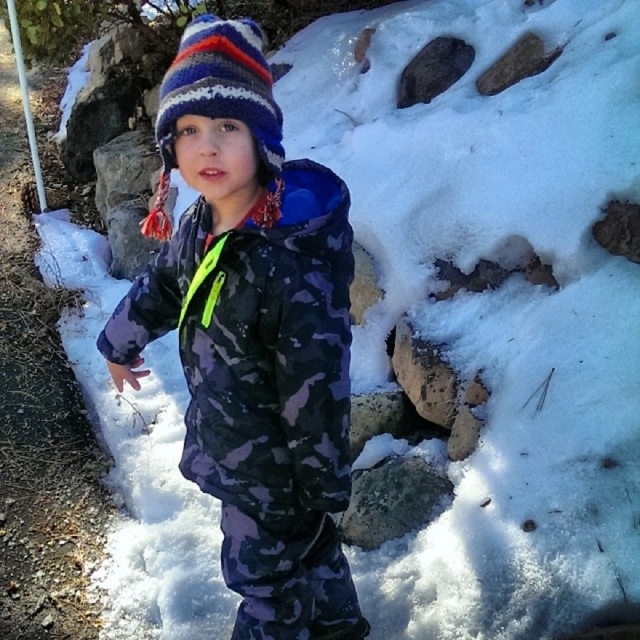
Question: Is camo fabric snowsuit at center wider than striped knit hat at center?

Choices:
 (A) no
 (B) yes

Answer: (B)

Question: Is camo fabric snowsuit at center to the left of striped knit hat at center from the viewer's perspective?

Choices:
 (A) yes
 (B) no

Answer: (B)

Question: Estimate the real-world distances between objects in this image. Which object is farther from the striped knit hat at center?

Choices:
 (A) camo fabric snowsuit at center
 (B) metallic pole at upper left

Answer: (B)

Question: Which of the following is the farthest from the observer?

Choices:
 (A) metallic pole at upper left
 (B) camo fabric snowsuit at center
 (C) striped knit hat at center

Answer: (A)

Question: Which point is closer to the camera?

Choices:
 (A) (17, 29)
 (B) (333, 611)

Answer: (B)

Question: Can you confirm if camo fabric snowsuit at center is smaller than striped knit hat at center?

Choices:
 (A) no
 (B) yes

Answer: (A)